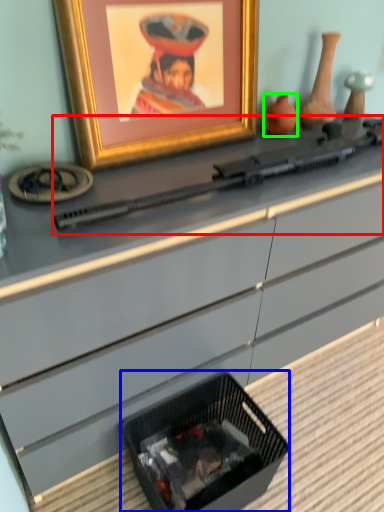
Question: Based on their relative distances, which object is farther from weapon (highlighted by a red box)? Choose from basket (highlighted by a blue box) and vase (highlighted by a green box).

Choices:
 (A) basket
 (B) vase

Answer: (A)